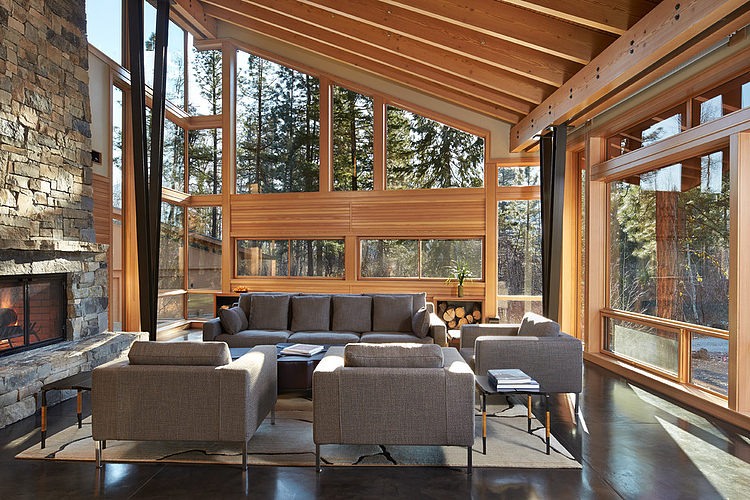
The height and width of the screenshot is (500, 750). I want to click on window, so click(409, 248).